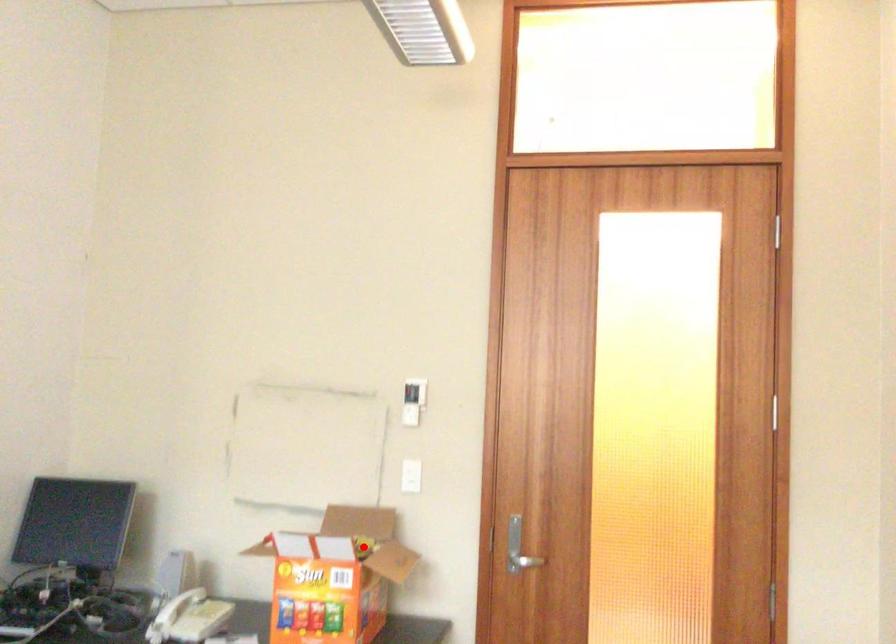
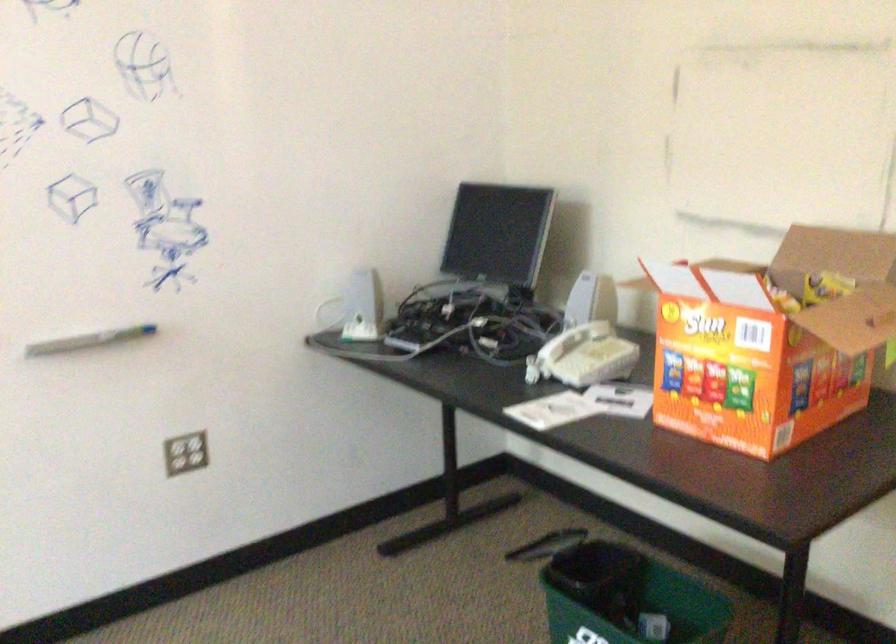
Question: I am providing you with two images of the same scene from different viewpoints. A red point is shown in image1. For the corresponding object point in image2, is it positioned nearer or farther from the camera?

Choices:
 (A) Nearer
 (B) Farther

Answer: (A)